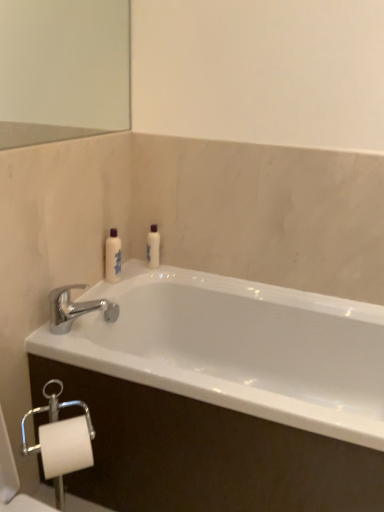
Find the location of a particular element. free point behind white glossy bottle at upper left, placed as the 2th toiletry when sorted from right to left is located at coordinates (135, 268).